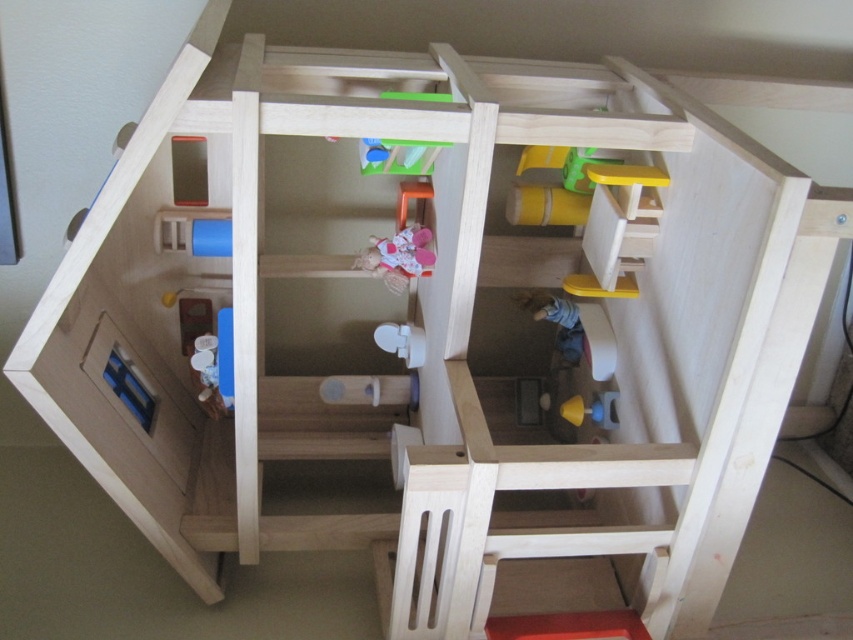
Question: Which point is closer to the camera taking this photo?

Choices:
 (A) (619, 634)
 (B) (573, 324)
 (C) (401, 240)

Answer: (A)

Question: Does smooth red stool at lower center have a greater width compared to smooth plastic spoon at upper center?

Choices:
 (A) no
 (B) yes

Answer: (B)

Question: Considering the real-world distances, which object is farthest from the blue fabric doll at center?

Choices:
 (A) matte pink doll at center
 (B) smooth yellow cup at center

Answer: (A)

Question: Does smooth red stool at lower center appear under smooth yellow cup at center?

Choices:
 (A) no
 (B) yes

Answer: (B)

Question: Does blue fabric doll at center have a lesser width compared to smooth yellow cup at center?

Choices:
 (A) no
 (B) yes

Answer: (A)

Question: Estimate the real-world distances between objects in this image. Which object is farther from the smooth red stool at lower center?

Choices:
 (A) blue fabric doll at center
 (B) smooth yellow cup at center
 (C) smooth plastic spoon at upper center
 (D) matte pink doll at center

Answer: (C)